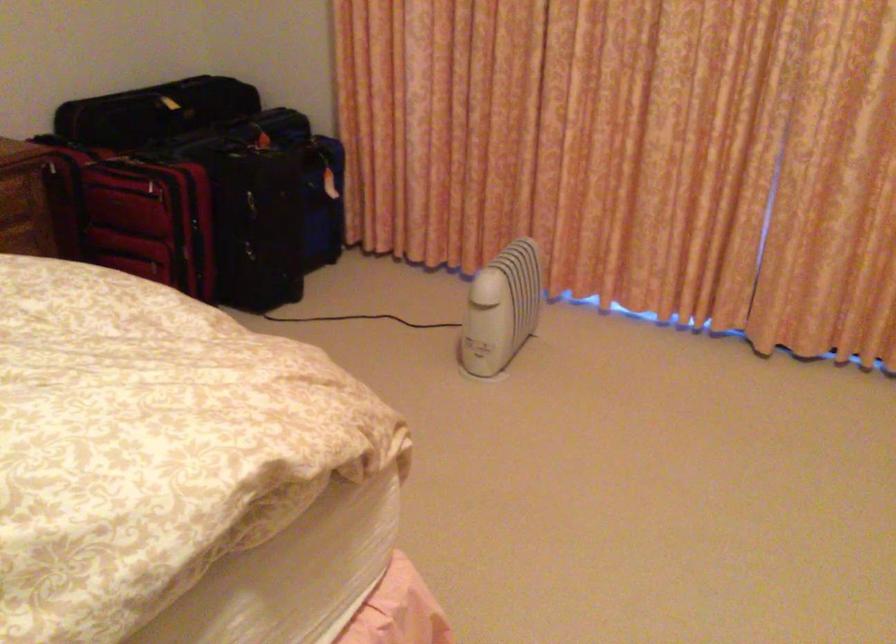
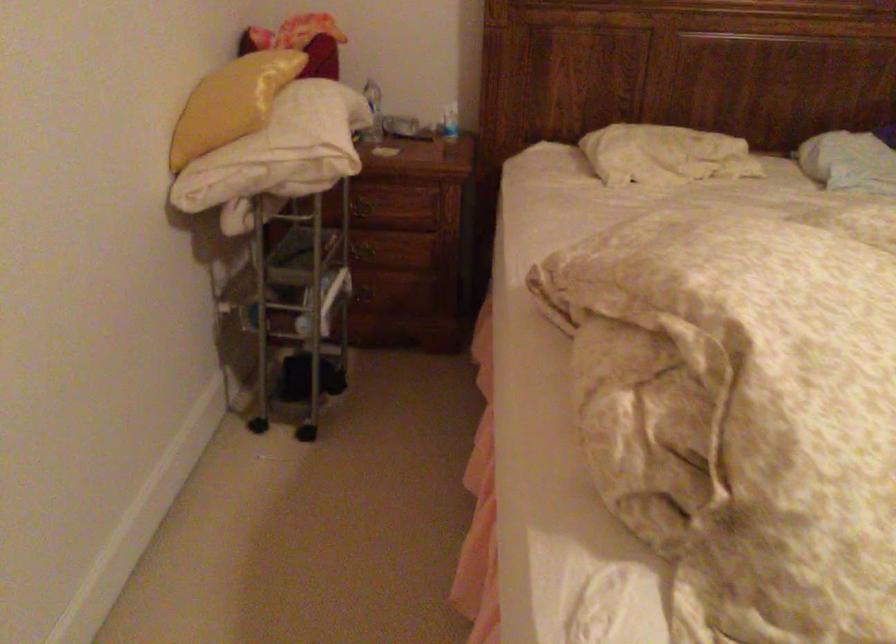
Question: The images are taken continuously from a first-person perspective. In which direction is your viewpoint rotating?

Choices:
 (A) Left
 (B) Right
 (C) Up
 (D) Down

Answer: (A)